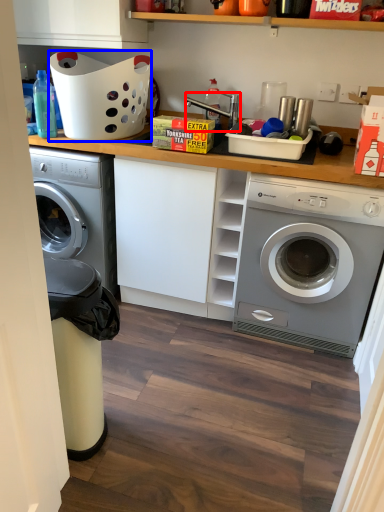
Question: Among these objects, which one is farthest to the camera, sink (highlighted by a red box) or basket (highlighted by a blue box)?

Choices:
 (A) sink
 (B) basket

Answer: (A)